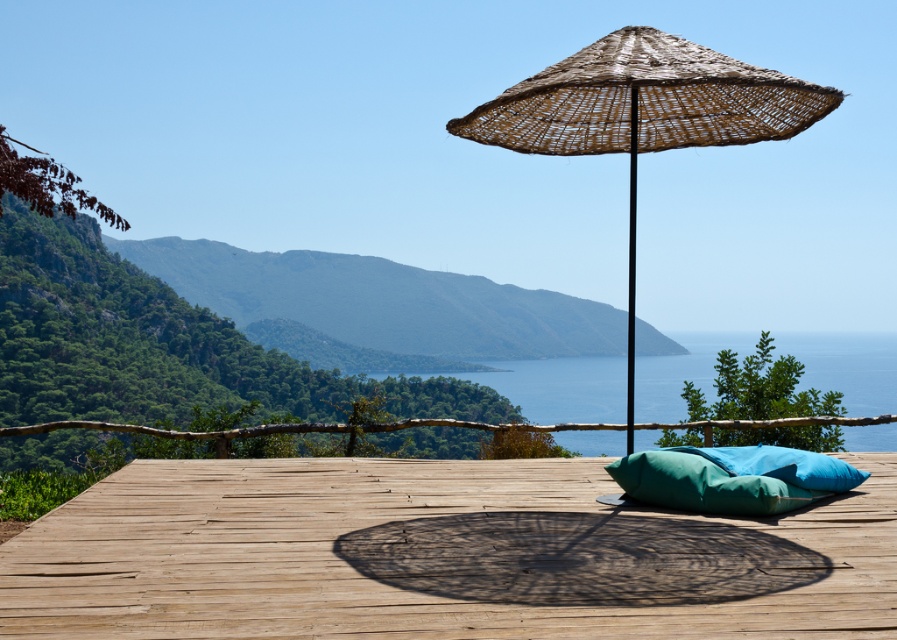
Can you confirm if teal fabric pillow at center is bigger than woven bamboo pole at center?

Incorrect, teal fabric pillow at center is not larger than woven bamboo pole at center.

In the scene shown: Does teal fabric pillow at center have a greater width compared to woven bamboo pole at center?

No.

Locate an element on the screen. teal fabric pillow at center is located at coordinates (782, 465).

Locate an element on the screen. This screenshot has width=897, height=640. woven straw umbrella at center is located at coordinates (645, 100).

Does woven straw umbrella at center have a smaller size compared to teal fabric cushion at center?

No.

Where is `woven straw umbrella at center`? woven straw umbrella at center is located at coordinates (645, 100).

Is the position of teal fabric cushion at center less distant than that of woven bamboo pole at center?

No, it is not.

Consider the image. Is teal fabric cushion at center to the right of woven bamboo pole at center from the viewer's perspective?

Incorrect, teal fabric cushion at center is not on the right side of woven bamboo pole at center.

At what (x,y) coordinates should I click in order to perform the action: click on teal fabric cushion at center. Please return your answer as a coordinate pair (x, y). Image resolution: width=897 pixels, height=640 pixels. Looking at the image, I should click on (704, 484).